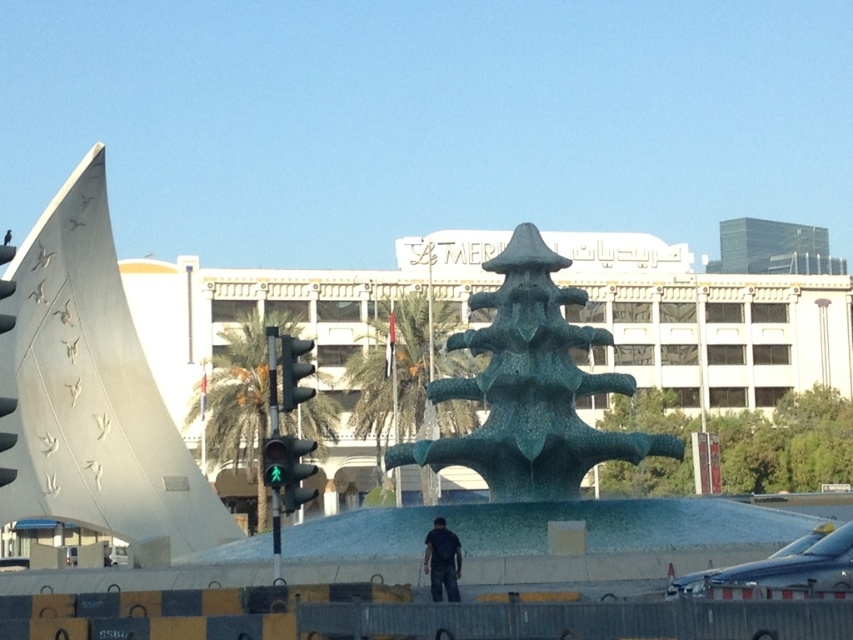
Can you confirm if green glass pedestrian signal at center is thinner than dark blue shirt at center?

Incorrect, green glass pedestrian signal at center's width is not less than dark blue shirt at center's.

Is point (265, 483) behind point (454, 596)?

That is False.

Who is more distant from viewer, (299, 464) or (459, 547)?

The point (459, 547) is behind.

Where is `green glass pedestrian signal at center`? This screenshot has height=640, width=853. green glass pedestrian signal at center is located at coordinates (288, 468).

Which of these two, dark blue shirt at center or green matte traffic light at center, stands taller?

Standing taller between the two is green matte traffic light at center.

From the picture: Is dark blue shirt at center taller than green matte traffic light at center?

No, dark blue shirt at center is not taller than green matte traffic light at center.

Locate an element on the screen. The width and height of the screenshot is (853, 640). dark blue shirt at center is located at coordinates pyautogui.click(x=442, y=561).

Which is more to the right, silver metallic fighter jet at lower right or green glass pedestrian signal at center?

silver metallic fighter jet at lower right

Locate an element on the screen. Image resolution: width=853 pixels, height=640 pixels. silver metallic fighter jet at lower right is located at coordinates (784, 564).